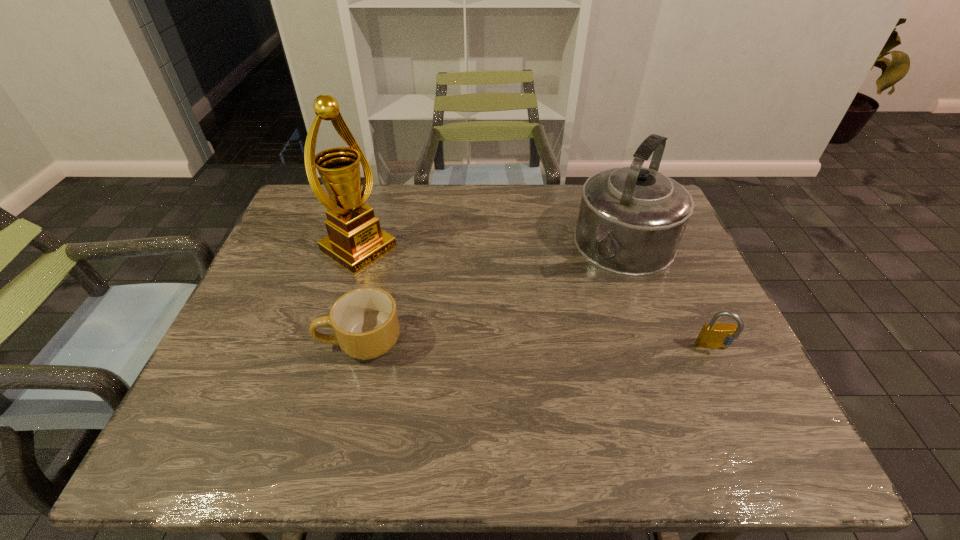
The image size is (960, 540). Identify the location of mug. (365, 322).

Where is `padlock`? The image size is (960, 540). padlock is located at coordinates (714, 335).

In order to click on award in this screenshot , I will do `click(355, 239)`.

Identify the location of the second tallest object. (631, 220).

Find the location of a particular element. This screenshot has height=540, width=960. free spot located on the side with the handle of the mug is located at coordinates (229, 341).

Find the location of `free location located on the side with the handle of the mug`. free location located on the side with the handle of the mug is located at coordinates (259, 341).

The height and width of the screenshot is (540, 960). I want to click on free location located 0.050m on the side with the handle of the mug, so click(299, 341).

Locate an element on the screen. free space located 0.130m on the side with the combination dials of the padlock is located at coordinates (743, 410).

The image size is (960, 540). In order to click on vacant position located on the front-facing side of the tallest object in this screenshot , I will do 498,339.

At what (x,y) coordinates should I click in order to perform the action: click on vacant space positioned 0.330m on the front-facing side of the tallest object. Please return your answer as a coordinate pair (x, y). This screenshot has height=540, width=960. Looking at the image, I should click on (475, 325).